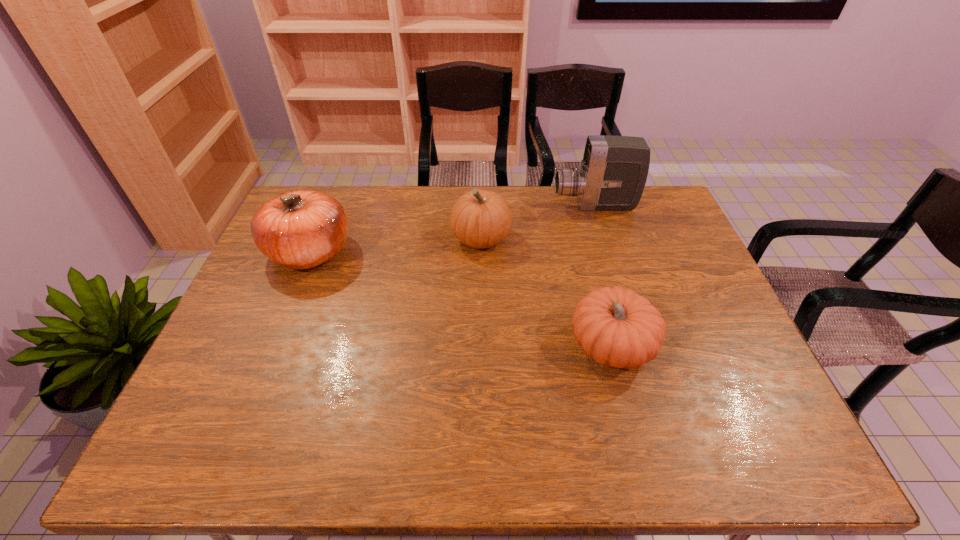
Locate an element on the screen. the tallest object is located at coordinates click(x=613, y=173).

This screenshot has height=540, width=960. What are the coordinates of `the farthest object` in the screenshot? It's located at (613, 173).

Identify the location of the second pumpkin from right to left. This screenshot has width=960, height=540. (479, 219).

You are a GUI agent. You are given a task and a screenshot of the screen. Output one action in this format:
    pyautogui.click(x=<x>, y=<y>)
    Task: Click on the leftmost object
    This screenshot has width=960, height=540.
    Given the screenshot: What is the action you would take?
    pyautogui.click(x=301, y=229)

Identify the location of the nearest object. (618, 328).

I want to click on the nearest pumpkin, so click(618, 328).

Identify the location of free region located at the front of the farthest object, highlighting the lens. This screenshot has height=540, width=960. (440, 206).

Image resolution: width=960 pixels, height=540 pixels. Identify the location of free space located at the front of the farthest object, highlighting the lens. (466, 206).

At what (x,y) coordinates should I click in order to perform the action: click on vacant point located at the front of the farthest object, highlighting the lens. Please return your answer as a coordinate pair (x, y). Looking at the image, I should click on (463, 206).

Locate an element on the screen. Image resolution: width=960 pixels, height=540 pixels. free location located on the stem of the second pumpkin from left to right is located at coordinates (411, 239).